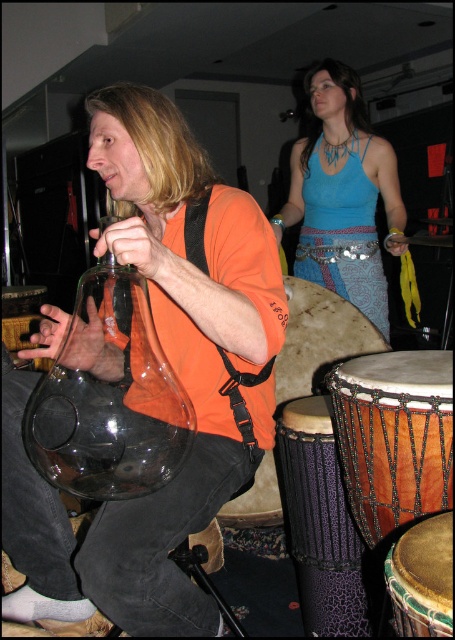
Question: Is brown textured drum at lower right bigger than leather drum at lower right?

Choices:
 (A) yes
 (B) no

Answer: (A)

Question: In this image, where is brown textured drum at lower right located relative to leather drum at center?

Choices:
 (A) above
 (B) below

Answer: (A)

Question: Which point is farther to the camera?

Choices:
 (A) leather-like textured drum at lower right
 (B) blue fabric top at upper center
 (C) transparent glass jug at center
 (D) leather drum at lower right

Answer: (B)

Question: Which point is closer to the camera taking this photo?

Choices:
 (A) (262, 502)
 (B) (333, 179)

Answer: (A)

Question: Does brown textured drum at lower right appear under leather drum at lower right?

Choices:
 (A) yes
 (B) no

Answer: (B)

Question: Which point is closer to the camera?

Choices:
 (A) (273, 481)
 (B) (267, 486)
 (C) (116, 529)

Answer: (C)